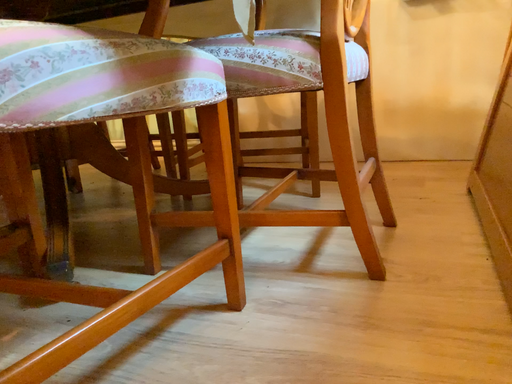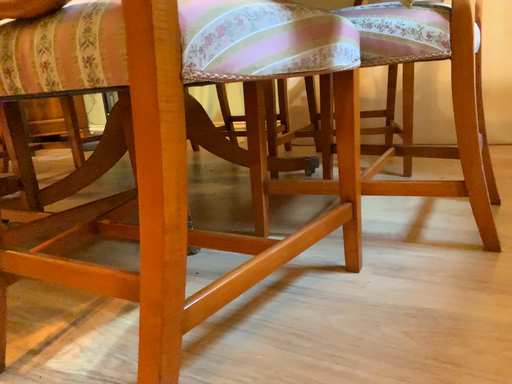
Question: Which way did the camera rotate in the video?

Choices:
 (A) rotated left
 (B) rotated right

Answer: (A)